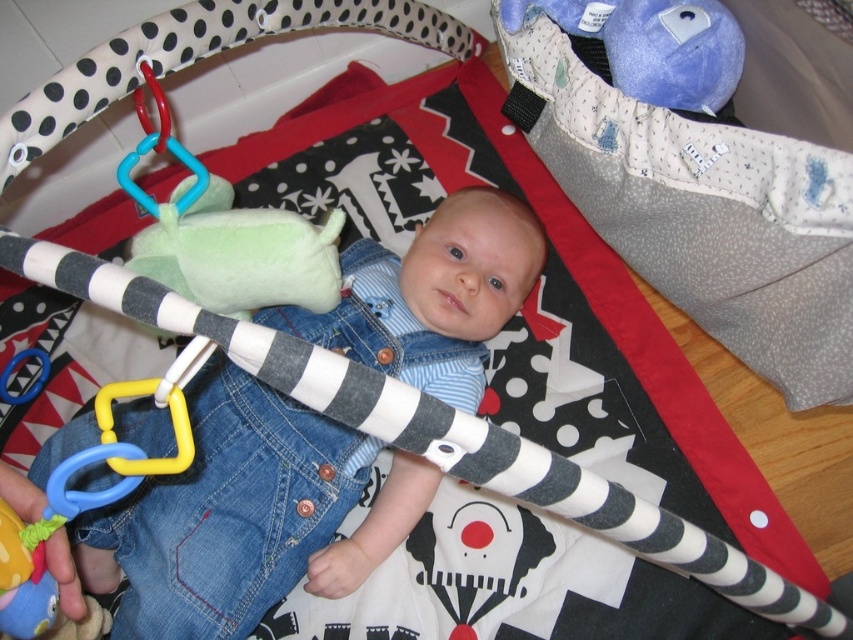
Based on the photo, does denim overalls at center have a larger size compared to green plush toy at center?

Correct, denim overalls at center is larger in size than green plush toy at center.

Does point (375, 451) come behind point (293, 253)?

Yes.

This screenshot has height=640, width=853. I want to click on denim overalls at center, so click(x=247, y=516).